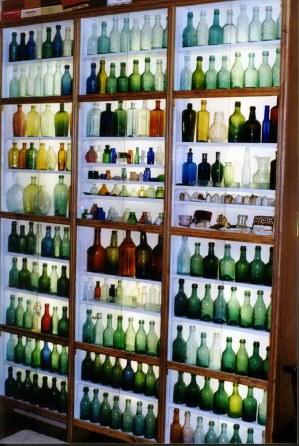
I want to click on bottom shelves, so click(x=106, y=432), click(x=63, y=418).